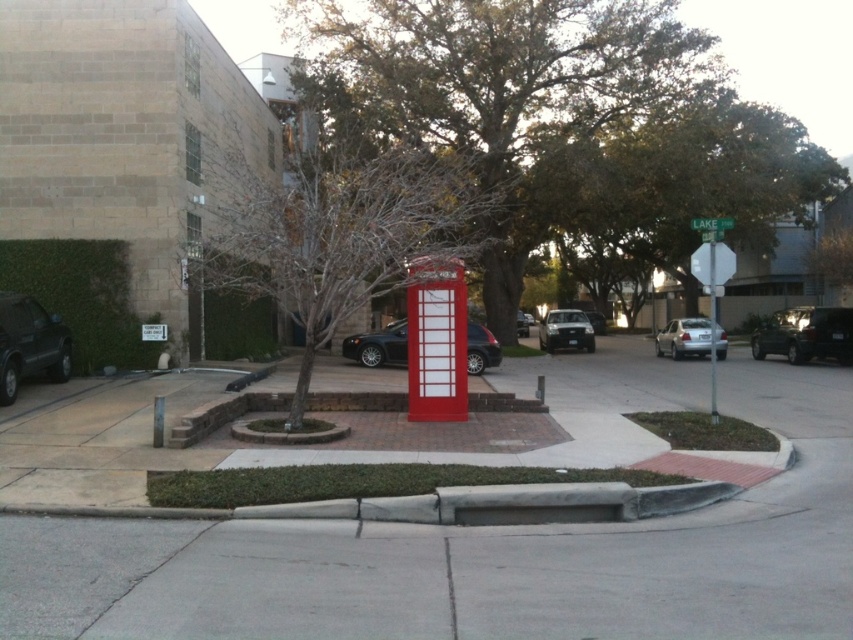
Between bare wood tree at center and silver metallic sedan at right, which one appears on the left side from the viewer's perspective?

bare wood tree at center

Does point (341, 148) come farther from viewer compared to point (691, 330)?

Yes.

At what (x,y) coordinates should I click in order to perform the action: click on bare wood tree at center. Please return your answer as a coordinate pair (x, y). The height and width of the screenshot is (640, 853). Looking at the image, I should click on (335, 228).

Is shiny black suv at right taller than satin silver sedan at center?

No.

Based on the photo, who is more distant from viewer, (x=793, y=317) or (x=595, y=310)?

Point (x=595, y=310)

Where is `shiny black suv at right`? This screenshot has height=640, width=853. shiny black suv at right is located at coordinates (805, 333).

Looking at this image, who is shorter, green leafy tree at upper center or shiny black sedan at center?

With less height is shiny black sedan at center.

Who is lower down, green leafy tree at upper center or shiny black sedan at center?

shiny black sedan at center is below.

Is point (717, 97) positioned in front of point (570, 316)?

Yes, it is.

Locate an element on the screen. The height and width of the screenshot is (640, 853). green leafy tree at upper center is located at coordinates 683,186.